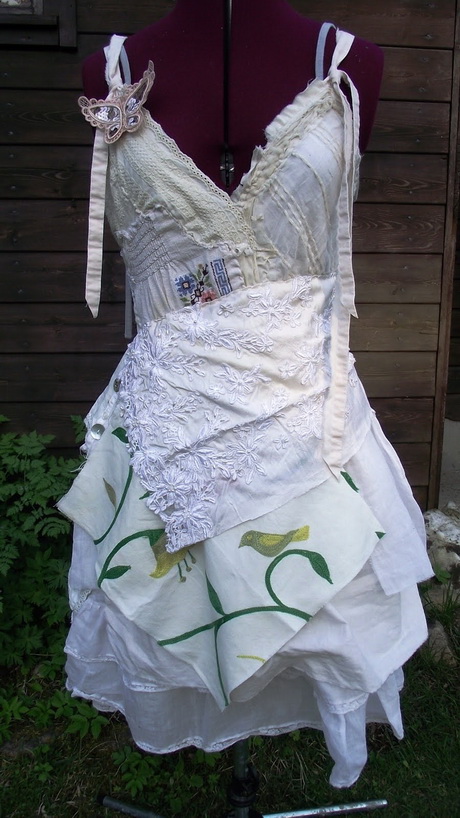
Where is `torn trim`? This screenshot has width=460, height=818. torn trim is located at coordinates (267, 137).